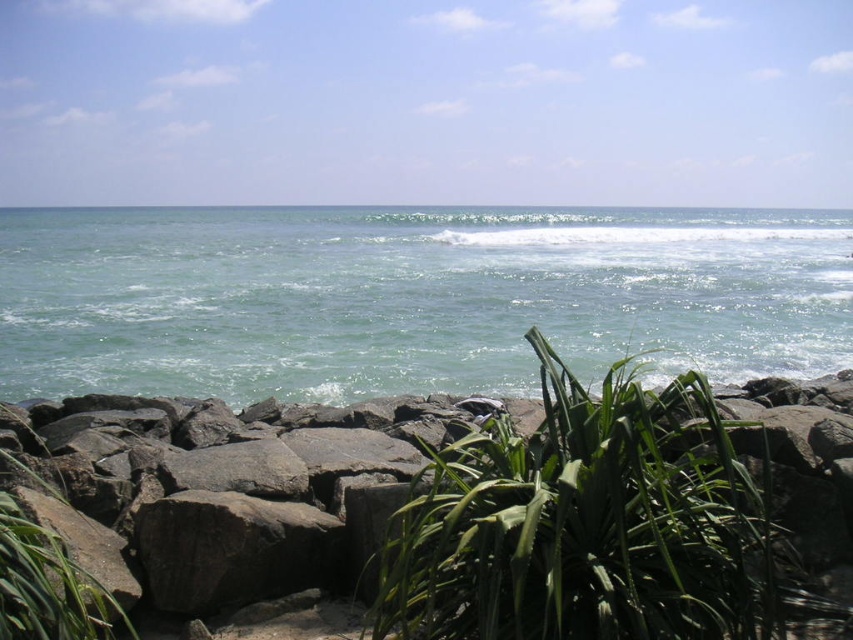
Is greenish-blue water at upper center to the left of green leafy plant at center from the viewer's perspective?

No, greenish-blue water at upper center is not to the left of green leafy plant at center.

Is greenish-blue water at upper center in front of green leafy plant at center?

No.

Measure the distance between point (212, 369) and camera.

Point (212, 369) and camera are 15.29 meters apart.

What are the coordinates of `greenish-blue water at upper center` in the screenshot? It's located at (409, 298).